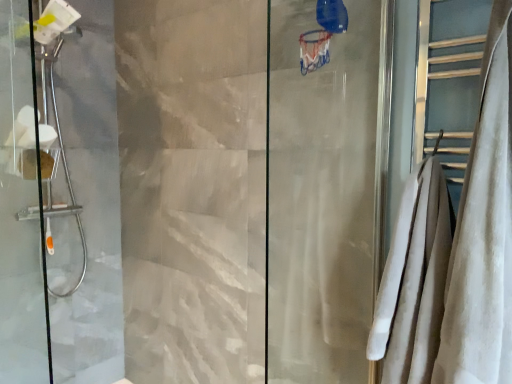
Question: From the image's perspective, is brushed metal showerhead at left, the second screen door positioned from the front, on top of transparent glass shower door at left, marked as the 1th screen door in a front-to-back arrangement?

Choices:
 (A) yes
 (B) no

Answer: (A)

Question: Could you tell me if brushed metal showerhead at left, the 1th screen door when ordered from back to front, is turned towards transparent glass shower door at left, marked as the 1th screen door in a front-to-back arrangement?

Choices:
 (A) yes
 (B) no

Answer: (B)

Question: From a real-world perspective, is brushed metal showerhead at left, the 1th screen door when ordered from back to front, located higher than transparent glass shower door at left, marked as the 1th screen door in a front-to-back arrangement?

Choices:
 (A) yes
 (B) no

Answer: (A)

Question: Is brushed metal showerhead at left, the 1th screen door when ordered from back to front, looking in the opposite direction of transparent glass shower door at left, marked as the 1th screen door in a front-to-back arrangement?

Choices:
 (A) no
 (B) yes

Answer: (A)

Question: From a real-world perspective, is brushed metal showerhead at left, the 1th screen door when ordered from back to front, positioned under transparent glass shower door at left, positioned as the 2th screen door in back-to-front order, based on gravity?

Choices:
 (A) yes
 (B) no

Answer: (B)

Question: Does brushed metal showerhead at left, the second screen door positioned from the front, have a lesser height compared to transparent glass shower door at left, marked as the 1th screen door in a front-to-back arrangement?

Choices:
 (A) yes
 (B) no

Answer: (B)

Question: Does brushed metal showerhead at left, the 1th screen door when ordered from back to front, lie in front of white velvety towel at right?

Choices:
 (A) no
 (B) yes

Answer: (A)

Question: Is brushed metal showerhead at left, the second screen door positioned from the front, located outside white velvety towel at right?

Choices:
 (A) no
 (B) yes

Answer: (B)

Question: From a real-world perspective, is brushed metal showerhead at left, the 1th screen door when ordered from back to front, positioned over white velvety towel at right based on gravity?

Choices:
 (A) no
 (B) yes

Answer: (B)

Question: Can you confirm if brushed metal showerhead at left, the second screen door positioned from the front, is smaller than white velvety towel at right?

Choices:
 (A) yes
 (B) no

Answer: (B)

Question: Is brushed metal showerhead at left, the second screen door positioned from the front, far away from white velvety towel at right?

Choices:
 (A) no
 (B) yes

Answer: (B)

Question: Does brushed metal showerhead at left, the second screen door positioned from the front, appear on the left side of white velvety towel at right?

Choices:
 (A) no
 (B) yes

Answer: (B)

Question: Is transparent glass shower door at left, positioned as the 2th screen door in back-to-front order, completely or partially outside of white velvety towel at right?

Choices:
 (A) yes
 (B) no

Answer: (A)